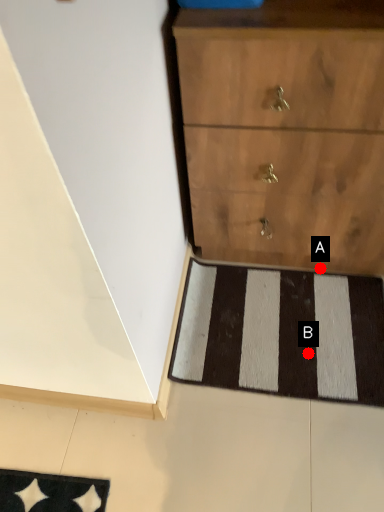
Question: Two points are circled on the image, labeled by A and B beside each circle. Which point is farther from the camera taking this photo?

Choices:
 (A) A is further
 (B) B is further

Answer: (A)